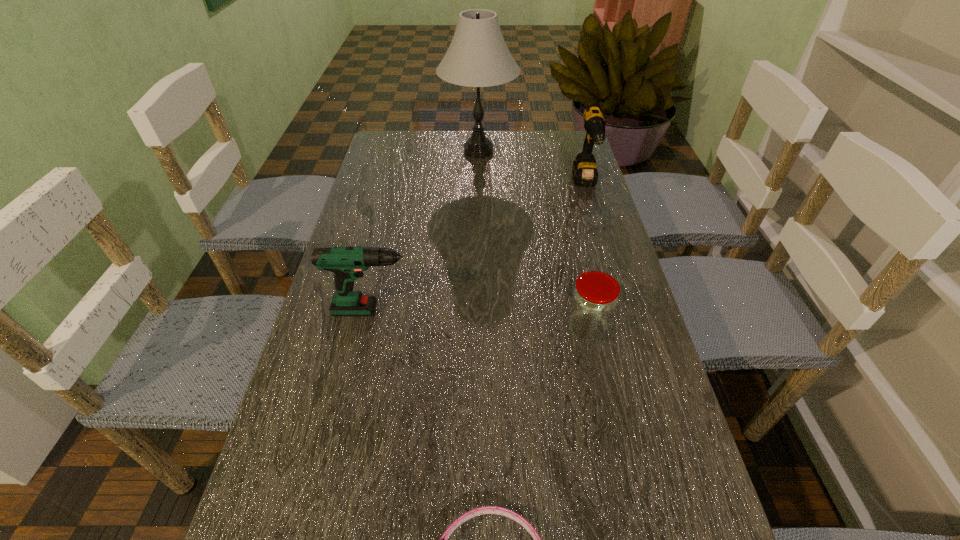
You are a GUI agent. You are given a task and a screenshot of the screen. Output one action in this format:
    pyautogui.click(x=<x>, y=<y>)
    Task: Click on the blank region between the rightmost object and the left drill
    
    Given the screenshot: What is the action you would take?
    pyautogui.click(x=483, y=247)

Find the location of a particular element. The height and width of the screenshot is (540, 960). free space between the lamp and the second object from right to left is located at coordinates (533, 239).

Where is `vacant area between the nearer drill and the jar`? vacant area between the nearer drill and the jar is located at coordinates (484, 319).

Where is `empty space that is in between the tallest object and the right drill`? This screenshot has height=540, width=960. empty space that is in between the tallest object and the right drill is located at coordinates (532, 167).

Image resolution: width=960 pixels, height=540 pixels. I want to click on vacant point located between the left drill and the lamp, so click(x=429, y=231).

The image size is (960, 540). In order to click on free area in between the second shortest object and the farther drill in this screenshot , I will do (x=586, y=255).

The height and width of the screenshot is (540, 960). Find the location of `free area in between the farther drill and the tallest object`. free area in between the farther drill and the tallest object is located at coordinates pos(532,167).

You are a GUI agent. You are given a task and a screenshot of the screen. Output one action in this format:
    pyautogui.click(x=<x>, y=<y>)
    Task: Click on the third closest object relative to the nearer drill
    The image size is (960, 540).
    Given the screenshot: What is the action you would take?
    pyautogui.click(x=478, y=56)

Identify the location of the fourth closest object relative to the lamp. (516, 517).

This screenshot has height=540, width=960. I want to click on free space that satisfies the following two spatial constraints: 1. on the front side of the jar; 2. on the right side of the lamp, so click(x=478, y=328).